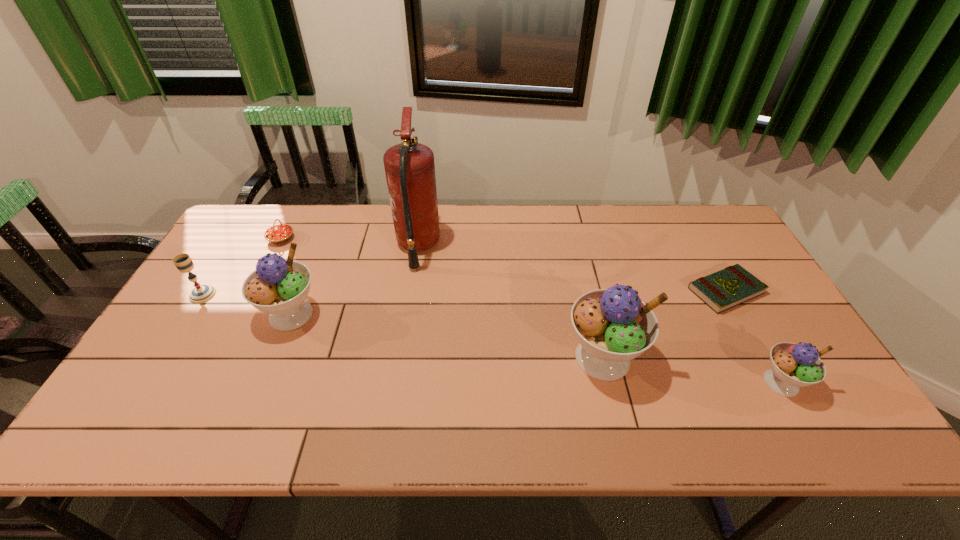
I want to click on location for an additional icecream to make spacing equal, so click(440, 335).